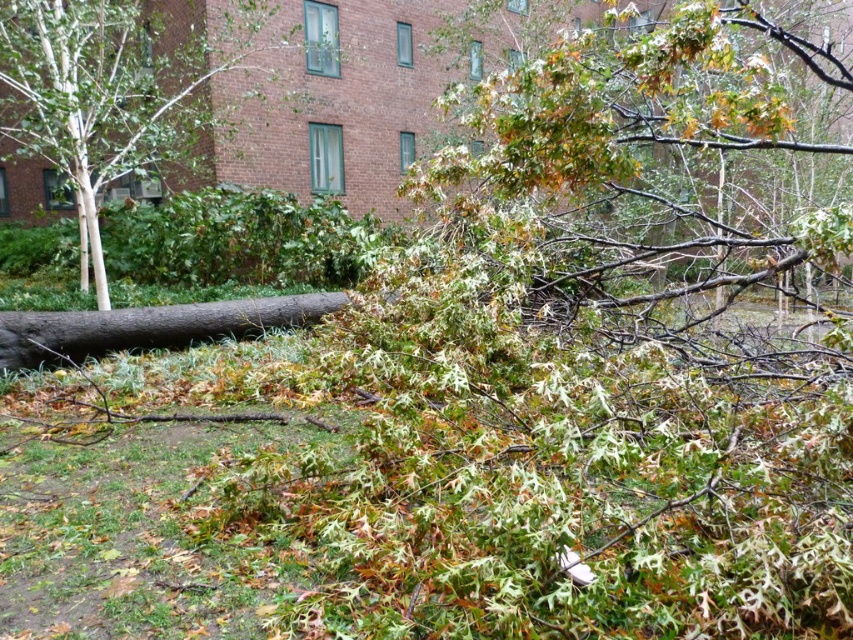
Does green leafy branches at upper right have a lesser width compared to smooth white bark at left?

Yes, green leafy branches at upper right is thinner than smooth white bark at left.

Can you confirm if green leafy branches at upper right is wider than smooth white bark at left?

Incorrect, green leafy branches at upper right's width does not surpass smooth white bark at left's.

Between point (718, 262) and point (38, 48), which one is positioned in front?

Point (38, 48)

I want to click on green leafy branches at upper right, so [630, 116].